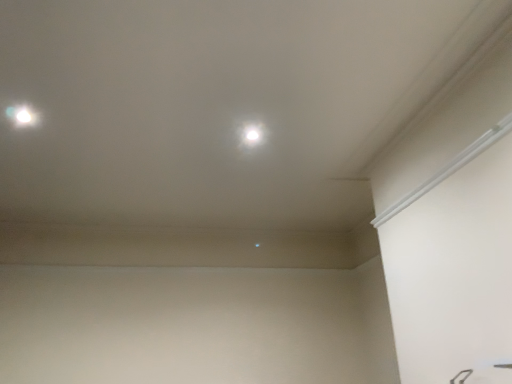
What do you see at coordinates (23, 116) in the screenshot?
I see `white glossy light at upper left, which ranks as the 1th dot in left-to-right order` at bounding box center [23, 116].

Where is `white glossy light at upper left, acting as the second dot starting from the right`? white glossy light at upper left, acting as the second dot starting from the right is located at coordinates (23, 116).

Locate an element on the screen. white glossy dot at center, arranged as the first dot when viewed from the right is located at coordinates (252, 134).

The width and height of the screenshot is (512, 384). What do you see at coordinates (252, 134) in the screenshot? I see `white glossy dot at center, the first dot viewed from the back` at bounding box center [252, 134].

You are a GUI agent. You are given a task and a screenshot of the screen. Output one action in this format:
    pyautogui.click(x=<x>, y=<y>)
    Task: Click on the white glossy light at upper left, marked as the 2th dot in a bottom-to-top arrangement
    
    Given the screenshot: What is the action you would take?
    pyautogui.click(x=23, y=116)

Which is more to the left, white glossy light at upper left, which is counted as the first dot, starting from the front, or white glossy dot at center, the 1th dot in the bottom-to-top sequence?

From the viewer's perspective, white glossy light at upper left, which is counted as the first dot, starting from the front, appears more on the left side.

Is white glossy light at upper left, marked as the 2th dot in a bottom-to-top arrangement, in front of or behind white glossy dot at center, arranged as the first dot when viewed from the right, in the image?

In the image, white glossy light at upper left, marked as the 2th dot in a bottom-to-top arrangement, appears in front of white glossy dot at center, arranged as the first dot when viewed from the right.

Between point (27, 110) and point (253, 138), which one is positioned in front?

Point (27, 110)

From the image's perspective, is white glossy light at upper left, marked as the 2th dot in a bottom-to-top arrangement, above or below white glossy dot at center, positioned as the second dot in top-to-bottom order?

From the image's perspective, white glossy light at upper left, marked as the 2th dot in a bottom-to-top arrangement, appears above white glossy dot at center, positioned as the second dot in top-to-bottom order.

From a real-world perspective, which object stands above the other?

white glossy dot at center, the 1th dot in the bottom-to-top sequence, is physically above.

Between white glossy light at upper left, acting as the second dot starting from the right, and white glossy dot at center, arranged as the first dot when viewed from the right, which one has smaller width?

With smaller width is white glossy light at upper left, acting as the second dot starting from the right.

Based on the photo, which of these two, white glossy light at upper left, which ranks as the 1th dot in left-to-right order, or white glossy dot at center, the first dot viewed from the back, stands shorter?

white glossy light at upper left, which ranks as the 1th dot in left-to-right order.

Considering the relative sizes of white glossy light at upper left, marked as the 2th dot in a bottom-to-top arrangement, and white glossy dot at center, arranged as the first dot when viewed from the right, in the image provided, is white glossy light at upper left, marked as the 2th dot in a bottom-to-top arrangement, bigger than white glossy dot at center, arranged as the first dot when viewed from the right,?

Incorrect, white glossy light at upper left, marked as the 2th dot in a bottom-to-top arrangement, is not larger than white glossy dot at center, arranged as the first dot when viewed from the right.

Is white glossy light at upper left, which is counted as the first dot, starting from the front, outside of white glossy dot at center, the 1th dot in the bottom-to-top sequence?

white glossy light at upper left, which is counted as the first dot, starting from the front, lies outside white glossy dot at center, the 1th dot in the bottom-to-top sequence,'s area.

Is white glossy light at upper left, which is counted as the first dot, starting from the front, in contact with white glossy dot at center, marked as the second dot in a left-to-right arrangement?

white glossy light at upper left, which is counted as the first dot, starting from the front, is not next to white glossy dot at center, marked as the second dot in a left-to-right arrangement, and they're not touching.

Is white glossy light at upper left, marked as the 2th dot in a bottom-to-top arrangement, facing towards white glossy dot at center, arranged as the first dot when viewed from the right?

No, white glossy light at upper left, marked as the 2th dot in a bottom-to-top arrangement, is not turned towards white glossy dot at center, arranged as the first dot when viewed from the right.

Can you tell me how much white glossy light at upper left, which is counted as the first dot, starting from the front, and white glossy dot at center, which ranks as the second dot in front-to-back order, differ in facing direction?

They differ by 2.16 degrees in their facing directions.

Where is `dot behind the white glossy light at upper left, which appears as the second dot when viewed from the back`? This screenshot has width=512, height=384. dot behind the white glossy light at upper left, which appears as the second dot when viewed from the back is located at coordinates (252, 134).

Is white glossy dot at center, positioned as the second dot in top-to-bottom order, at the right side of white glossy light at upper left, which appears as the second dot when viewed from the back?

Indeed, white glossy dot at center, positioned as the second dot in top-to-bottom order, is positioned on the right side of white glossy light at upper left, which appears as the second dot when viewed from the back.

Does white glossy dot at center, the 1th dot in the bottom-to-top sequence, lie behind white glossy light at upper left, which is the 1th dot in top-to-bottom order?

That is True.

Which is in front, point (246, 133) or point (18, 117)?

The point (18, 117) is closer to the camera.

From the image's perspective, which one is positioned lower, white glossy dot at center, which ranks as the second dot in front-to-back order, or white glossy light at upper left, marked as the 2th dot in a bottom-to-top arrangement?

white glossy dot at center, which ranks as the second dot in front-to-back order, from the image's perspective.

From a real-world perspective, between white glossy dot at center, marked as the second dot in a left-to-right arrangement, and white glossy light at upper left, which appears as the second dot when viewed from the back, who is vertically higher?

white glossy dot at center, marked as the second dot in a left-to-right arrangement.

Does white glossy dot at center, which ranks as the second dot in front-to-back order, have a greater width compared to white glossy light at upper left, which is counted as the first dot, starting from the front?

Yes, white glossy dot at center, which ranks as the second dot in front-to-back order, is wider than white glossy light at upper left, which is counted as the first dot, starting from the front.

Based on the photo, considering the relative sizes of white glossy dot at center, marked as the second dot in a left-to-right arrangement, and white glossy light at upper left, acting as the second dot starting from the right, in the image provided, is white glossy dot at center, marked as the second dot in a left-to-right arrangement, shorter than white glossy light at upper left, acting as the second dot starting from the right,?

Incorrect, the height of white glossy dot at center, marked as the second dot in a left-to-right arrangement, does not fall short of that of white glossy light at upper left, acting as the second dot starting from the right.

Considering the relative sizes of white glossy dot at center, which ranks as the second dot in front-to-back order, and white glossy light at upper left, which ranks as the 1th dot in left-to-right order, in the image provided, is white glossy dot at center, which ranks as the second dot in front-to-back order, smaller than white glossy light at upper left, which ranks as the 1th dot in left-to-right order,?

No.

Is white glossy dot at center, positioned as the second dot in top-to-bottom order, completely or partially outside of white glossy light at upper left, which appears as the second dot when viewed from the back?

Absolutely, white glossy dot at center, positioned as the second dot in top-to-bottom order, is external to white glossy light at upper left, which appears as the second dot when viewed from the back.

Is white glossy dot at center, the 1th dot in the bottom-to-top sequence, far away from white glossy light at upper left, which appears as the second dot when viewed from the back?

That's right, there is a large distance between white glossy dot at center, the 1th dot in the bottom-to-top sequence, and white glossy light at upper left, which appears as the second dot when viewed from the back.

Is white glossy dot at center, the first dot viewed from the back, facing away from white glossy light at upper left, marked as the 2th dot in a bottom-to-top arrangement?

No, white glossy light at upper left, marked as the 2th dot in a bottom-to-top arrangement, is not at the back of white glossy dot at center, the first dot viewed from the back.

The height and width of the screenshot is (384, 512). I want to click on dot above the white glossy dot at center, the first dot viewed from the back (from the image's perspective), so click(x=23, y=116).

Identify the location of dot above the white glossy light at upper left, which is counted as the first dot, starting from the front (from a real-world perspective). (252, 134).

Where is `dot behind the white glossy light at upper left, which appears as the second dot when viewed from the back`? The width and height of the screenshot is (512, 384). dot behind the white glossy light at upper left, which appears as the second dot when viewed from the back is located at coordinates (252, 134).